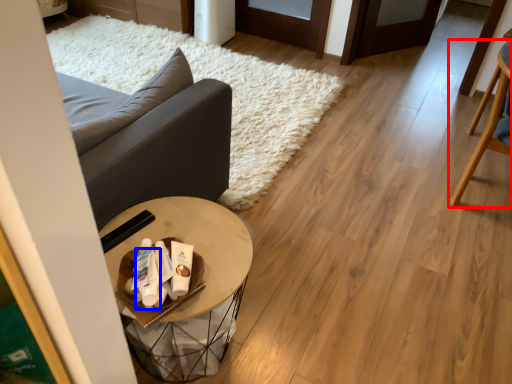
Question: Among these objects, which one is farthest to the camera, chair (highlighted by a red box) or toiletry (highlighted by a blue box)?

Choices:
 (A) chair
 (B) toiletry

Answer: (A)